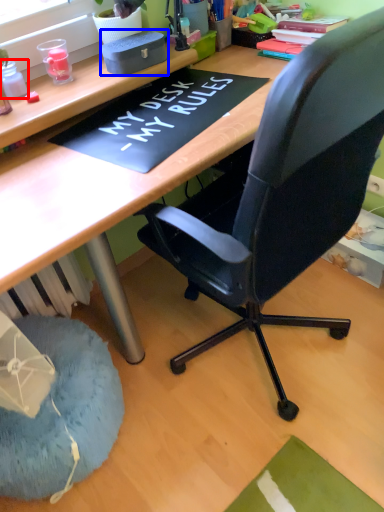
Question: Which object is further to the camera taking this photo, stationery (highlighted by a red box) or stationery (highlighted by a blue box)?

Choices:
 (A) stationery
 (B) stationery

Answer: (B)